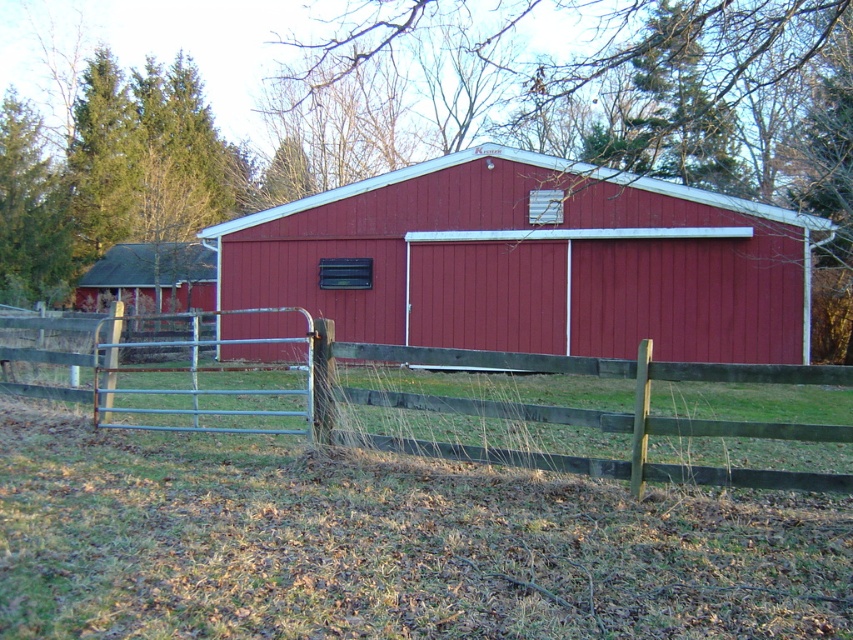
You are a painter planning to paint the smooth red barn at center and the wooden fence at lower left. You have a limited amount of paint. Based on the scene, which object requires more paint to cover its entire surface?

The wooden fence at lower left requires more paint because its width is greater than the smooth red barn at center.

Based on the photo, you are a painter planning to paint the smooth red barn at center and the wooden fence at lower left. You have a limited amount of paint. Based on their sizes, which object will require more paint?

The wooden fence at lower left will require more paint because it is larger than the smooth red barn at center.

You are standing in a field and see the smooth red barn at center and the wooden fence at lower left. Which object is positioned more to the east?

The smooth red barn at center is positioned more to the east than the wooden fence at lower left because it is to the right of the wooden fence at lower left.